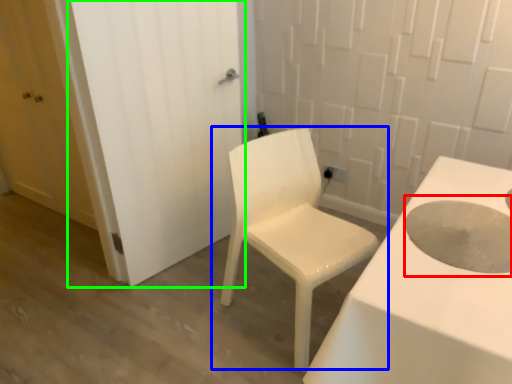
Question: Which object is the farthest from hole (highlighted by a red box)? Choose among these: chair (highlighted by a blue box) or door (highlighted by a green box).

Choices:
 (A) chair
 (B) door

Answer: (B)